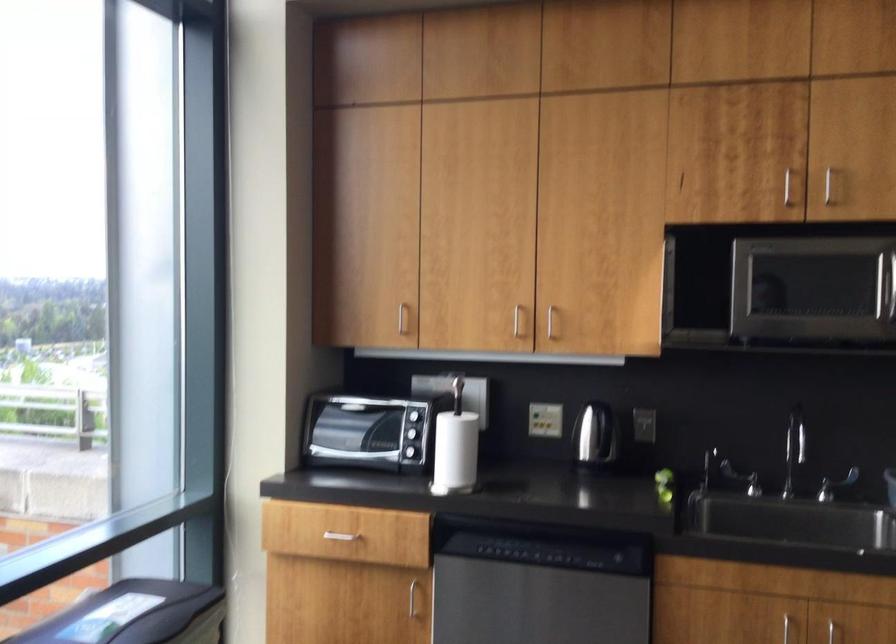
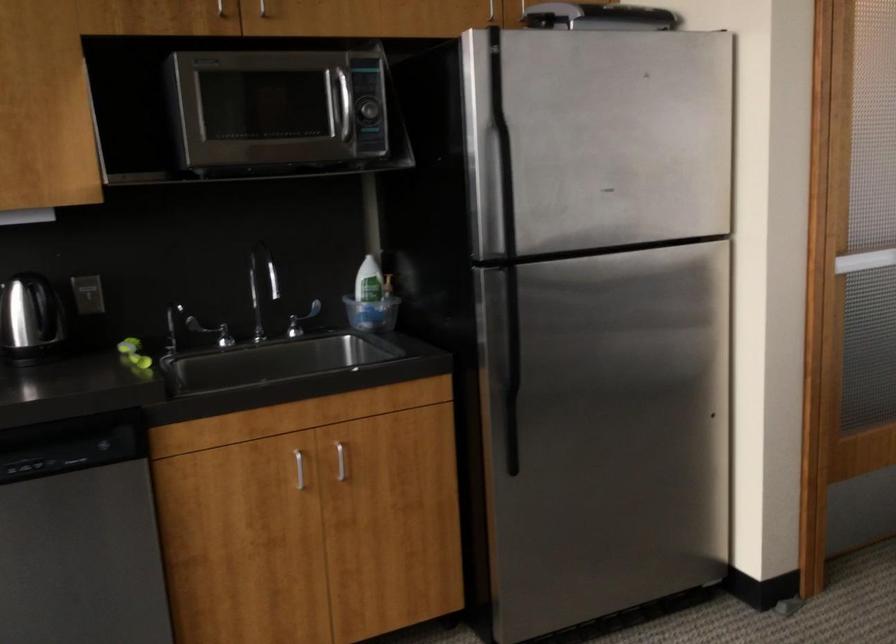
Question: The camera is either moving clockwise (left) or counter-clockwise (right) around the object. The first image is from the beginning of the video and the second image is from the end. Is the camera moving left or right when shooting the video?

Choices:
 (A) Left
 (B) Right

Answer: (A)